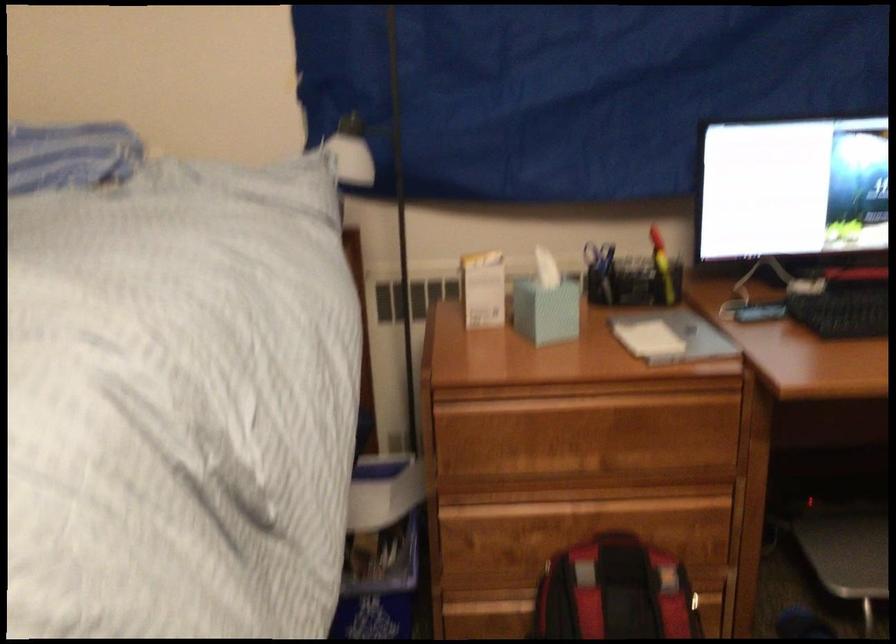
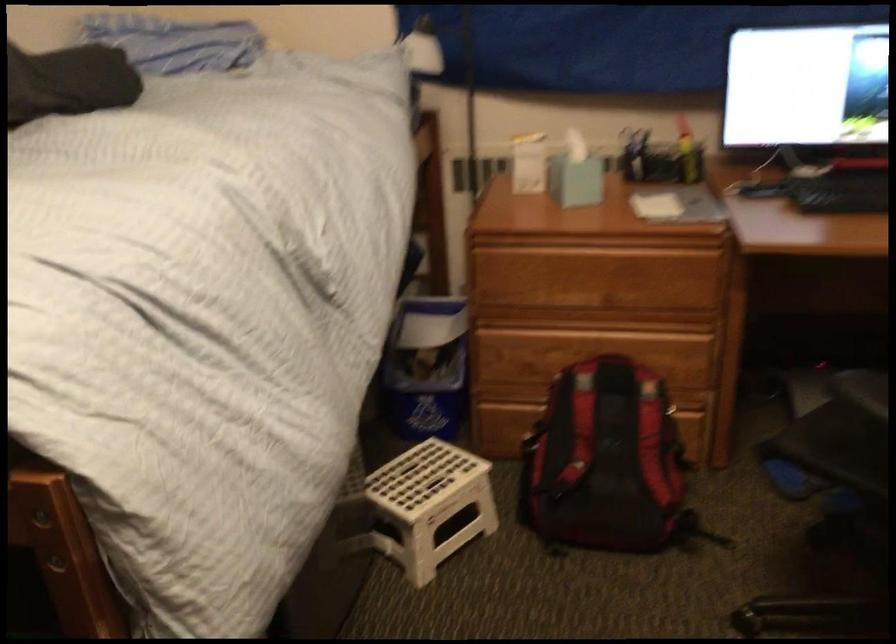
In a continuous first-person perspective shot, in which direction is the camera moving?

The cameraman moved toward right, backward.